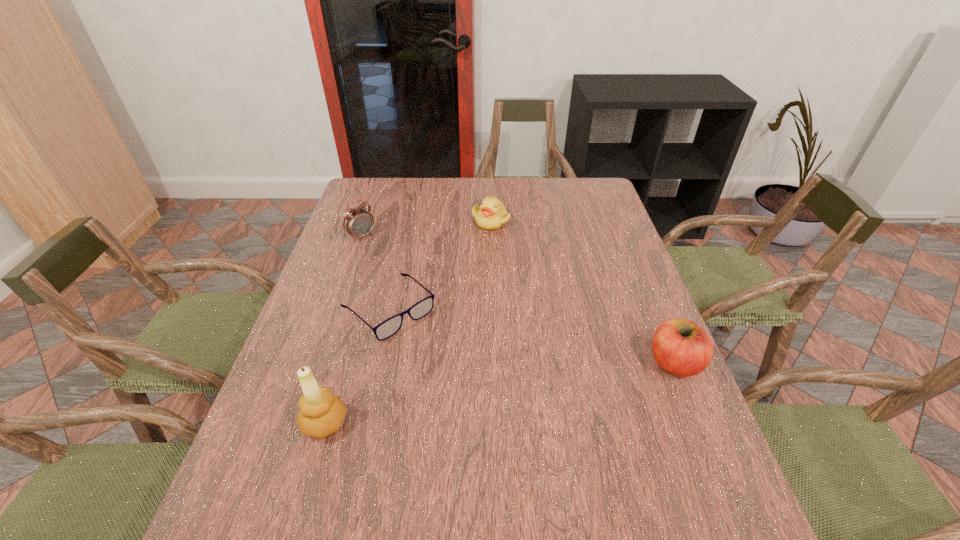
Where is `blank area located 0.050m on the front-facing side of the shortest object`? blank area located 0.050m on the front-facing side of the shortest object is located at coordinates (428, 347).

Locate an element on the screen. This screenshot has width=960, height=540. vacant space situated on the front-facing side of the shortest object is located at coordinates (434, 352).

Identify the location of vacant space positioned on the face of the alarm clock. Image resolution: width=960 pixels, height=540 pixels. (418, 280).

Where is `free space located on the face of the alarm clock`? The image size is (960, 540). free space located on the face of the alarm clock is located at coordinates (380, 251).

This screenshot has width=960, height=540. I want to click on free space located on the face of the alarm clock, so click(x=440, y=298).

The height and width of the screenshot is (540, 960). Find the location of `free spot located at the face of the fourth tallest object`. free spot located at the face of the fourth tallest object is located at coordinates (483, 264).

You are a GUI agent. You are given a task and a screenshot of the screen. Output one action in this format:
    pyautogui.click(x=<x>, y=<y>)
    Task: Click on the free space located at the face of the fourth tallest object
    
    Given the screenshot: What is the action you would take?
    pyautogui.click(x=485, y=254)

Find the location of a particular element. free location located 0.090m at the face of the fourth tallest object is located at coordinates (486, 248).

You are a GUI agent. You are given a task and a screenshot of the screen. Output one action in this format:
    pyautogui.click(x=<x>, y=<y>)
    Task: Click on the object that is at the far edge
    The width and height of the screenshot is (960, 540).
    Given the screenshot: What is the action you would take?
    pyautogui.click(x=491, y=215)

Where is `candle_holder that is positioned at the left edge`? The width and height of the screenshot is (960, 540). candle_holder that is positioned at the left edge is located at coordinates (321, 414).